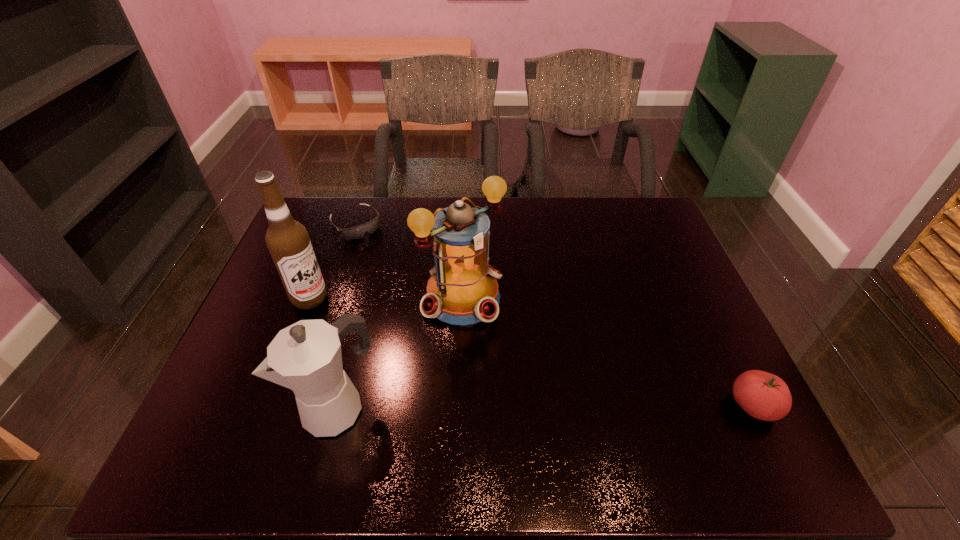
Where is `free spot between the lantern and the third tallest object`? This screenshot has height=540, width=960. free spot between the lantern and the third tallest object is located at coordinates (401, 352).

Locate an element on the screen. vacant area that lies between the alcohol and the shortest object is located at coordinates (333, 261).

Locate an element on the screen. This screenshot has height=540, width=960. object that is the third closest to the alcohol is located at coordinates (463, 289).

Identify which object is the second closest to the alcohol. Please provide its 2D coordinates. Your answer should be formatted as a tuple, i.e. [(x, y)], where the tuple contains the x and y coordinates of a point satisfying the conditions above.

[(306, 357)]

At what (x,y) coordinates should I click in order to perform the action: click on vacant point that satisfies the following two spatial constraints: 1. on the front side of the coffeepot; 2. on the left side of the alcohol. Please return your answer as a coordinate pair (x, y). This screenshot has height=540, width=960. Looking at the image, I should click on (269, 407).

What are the coordinates of `vacant space that satisfies the following two spatial constraints: 1. on the back side of the goggles; 2. on the left side of the alcohol` in the screenshot? It's located at (338, 225).